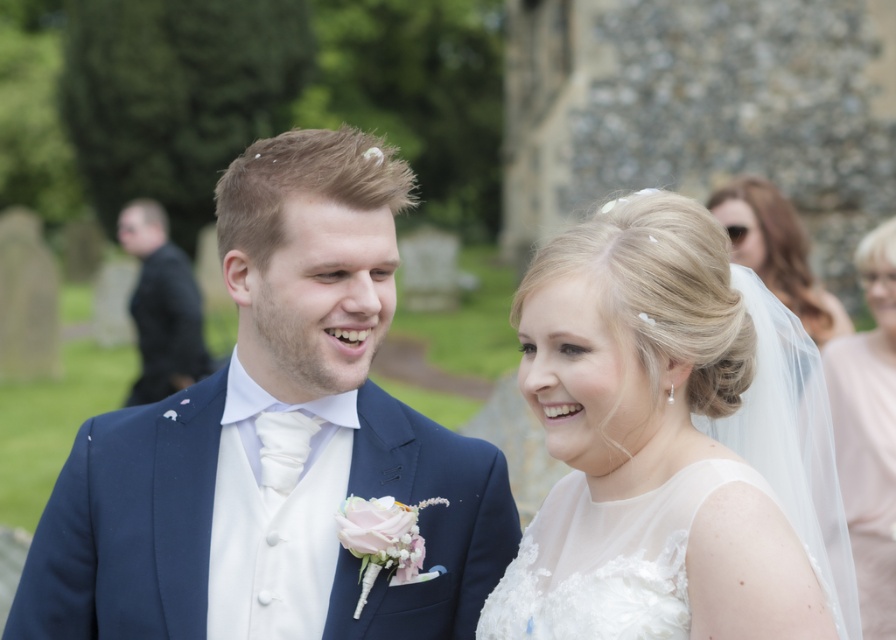
From the picture: Can you confirm if navy blue suit at center is positioned to the right of translucent white veil at right?

Incorrect, navy blue suit at center is not on the right side of translucent white veil at right.

Between navy blue suit at center and translucent white veil at right, which one appears on the right side from the viewer's perspective?

From the viewer's perspective, translucent white veil at right appears more on the right side.

Which is behind, point (234, 164) or point (881, 426)?

The point (881, 426) is more distant.

Image resolution: width=896 pixels, height=640 pixels. Find the location of `navy blue suit at center`. navy blue suit at center is located at coordinates (263, 440).

Which is more to the right, translucent white veil at right or black suit at left?

From the viewer's perspective, translucent white veil at right appears more on the right side.

Between translucent white veil at right and black suit at left, which one has less height?

With less height is black suit at left.

Who is more forward, (877, 589) or (184, 371)?

Point (877, 589) is more forward.

Where is `translucent white veil at right`? The image size is (896, 640). translucent white veil at right is located at coordinates (868, 432).

Is point (799, 472) less distant than point (142, 221)?

Yes, it is.

Is white lace dress at center bigger than black suit at left?

No, white lace dress at center is not bigger than black suit at left.

Where is `white lace dress at center`? The height and width of the screenshot is (640, 896). white lace dress at center is located at coordinates (672, 444).

The height and width of the screenshot is (640, 896). In order to click on white lace dress at center in this screenshot , I will do `click(672, 444)`.